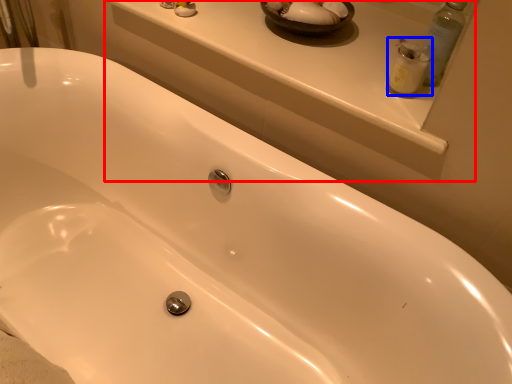
Question: Which of the following is the farthest to the observer, window sill (highlighted by a red box) or cleaning product (highlighted by a blue box)?

Choices:
 (A) window sill
 (B) cleaning product

Answer: (B)